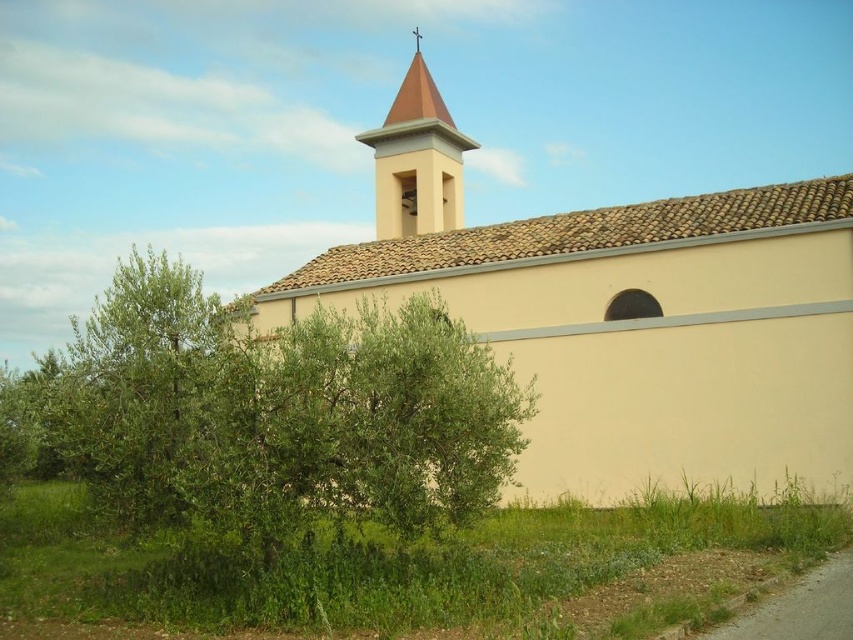
Is beige stucco church at center further to the viewer compared to green leafy tree at center?

Yes, it is.

Is beige stucco church at center wider than green leafy tree at center?

No, beige stucco church at center is not wider than green leafy tree at center.

Identify the location of beige stucco church at center. This screenshot has width=853, height=640. (619, 316).

Image resolution: width=853 pixels, height=640 pixels. Identify the location of beige stucco church at center. (619, 316).

Who is positioned more to the left, beige stucco church at center or matte yellow bell tower at upper center?

From the viewer's perspective, matte yellow bell tower at upper center appears more on the left side.

Consider the image. Can you confirm if beige stucco church at center is positioned to the right of matte yellow bell tower at upper center?

Indeed, beige stucco church at center is positioned on the right side of matte yellow bell tower at upper center.

Who is more forward, (x=572, y=358) or (x=409, y=212)?

Point (x=572, y=358) is in front.

This screenshot has width=853, height=640. Identify the location of beige stucco church at center. (619, 316).

Does green leafy tree at center have a larger size compared to matte yellow bell tower at upper center?

Indeed, green leafy tree at center has a larger size compared to matte yellow bell tower at upper center.

Between green leafy tree at center and matte yellow bell tower at upper center, which one appears on the right side from the viewer's perspective?

Positioned to the right is matte yellow bell tower at upper center.

Is point (384, 333) in front of point (378, 196)?

Yes, point (384, 333) is closer to viewer.

You are a GUI agent. You are given a task and a screenshot of the screen. Output one action in this format:
    pyautogui.click(x=<x>, y=<y>)
    Task: Click on the green leafy tree at center
    The width and height of the screenshot is (853, 640).
    Given the screenshot: What is the action you would take?
    pyautogui.click(x=271, y=416)